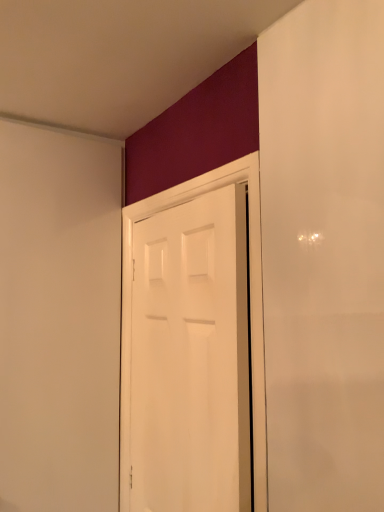
Describe the element at coordinates (251, 308) in the screenshot. Image resolution: width=384 pixels, height=512 pixels. I see `white glossy door at center` at that location.

Locate an element on the screen. The image size is (384, 512). white glossy door at center is located at coordinates (251, 308).

Where is `white glossy door at center`? white glossy door at center is located at coordinates (251, 308).